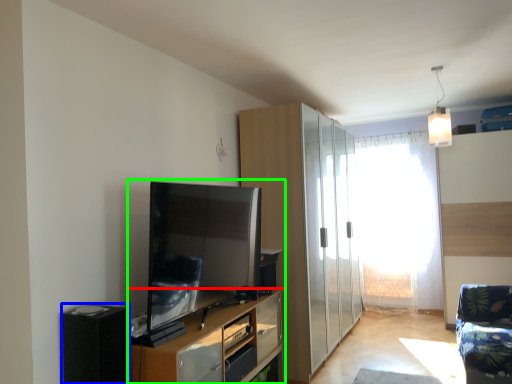
Question: Which is farther away from cupboard (highlighted by a red box)? appliance (highlighted by a blue box) or entertainment center (highlighted by a green box)?

Choices:
 (A) appliance
 (B) entertainment center

Answer: (A)